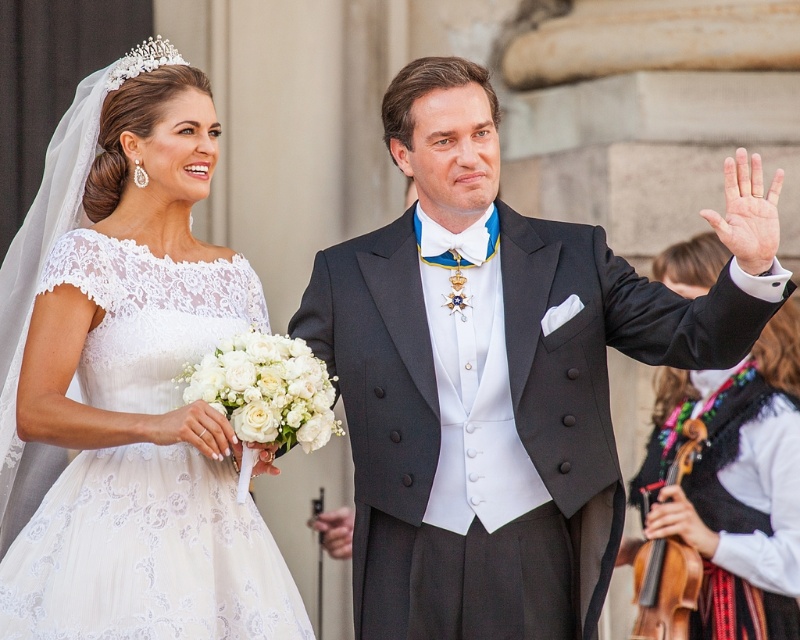
You are a photographer setting up for the wedding photoshoot. You need to position a backdrop that is 2 meters wide. The matte black suit at center and the black knit vest at right are in the frame. Will the backdrop be wide enough to cover both objects without cropping them?

The matte black suit at center might be wider than black knit vest at right. Since the backdrop is 2 meters wide, it depends on the combined width of both objects. However, without exact measurements, it is uncertain if they will fit together within the backdrop.

Looking at this image, you are a photographer positioned at the back of the venue. You need to take a photo of the matte black suit at center and the black knit vest at right. Can you ensure both subjects are in frame without moving your camera? The camera has a 50mm lens with a 46.66 feet focal length coverage.

The distance between the matte black suit at center and the black knit vest at right is 29.50 feet, which is within the 46.66 feet focal length coverage of the camera lens. Therefore, both subjects can be captured in the same frame without moving the camera.